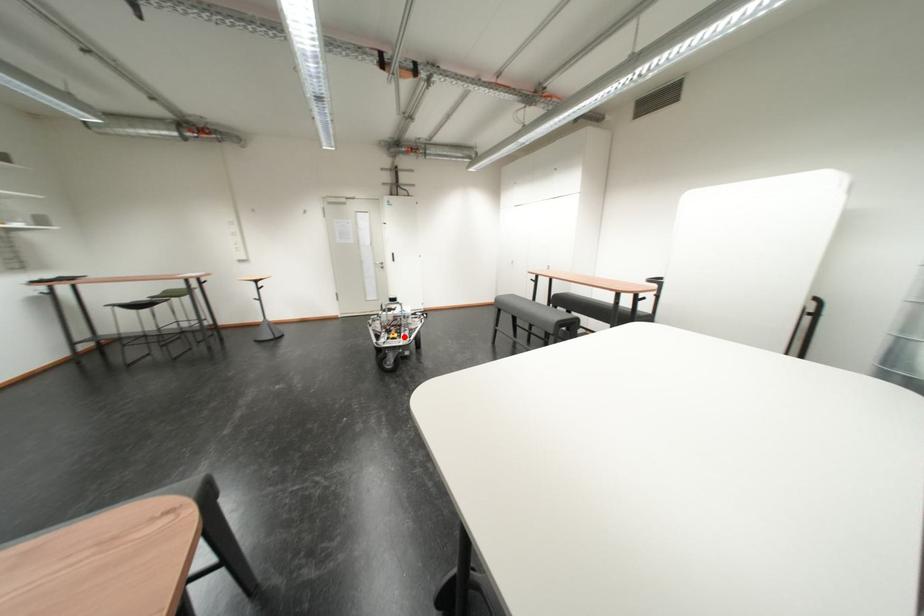
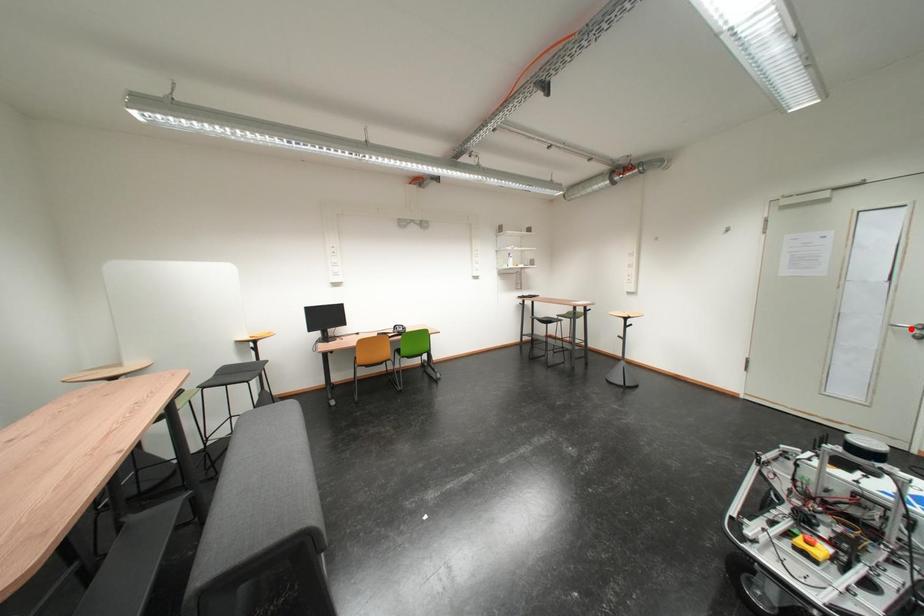
I am providing you with two images of the same scene from different viewpoints. A red point is marked on the first image and another point is marked on the second image. Is the marked point in image1 the same physical position as the marked point in image2?

No